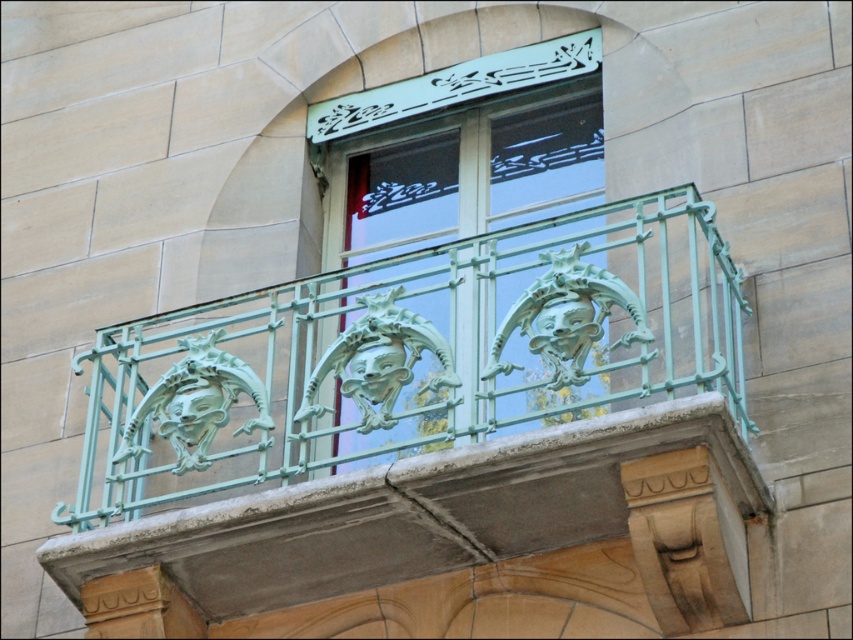
Based on the photo, you are an architect inspecting the building facade. You notice the green patina metal railing at center and the green patina metal at upper center. Which of these two elements has a greater height?

The green patina metal railing at center has a greater height compared to the green patina metal at upper center.

You are an architect inspecting the building facade. You need to compare the sizes of the green patina metal railing at center and the smooth beige stone at lower right. Which one is bigger?

The green patina metal railing at center is larger in size than the smooth beige stone at lower right according to the description.